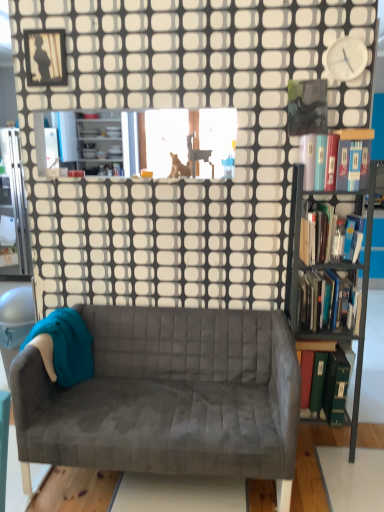
This screenshot has height=512, width=384. What do you see at coordinates (346, 58) in the screenshot?
I see `white plastic clock at upper right` at bounding box center [346, 58].

The width and height of the screenshot is (384, 512). I want to click on hardcover book at right, arranged as the 2th book when viewed from the top, so click(x=328, y=234).

The width and height of the screenshot is (384, 512). What are the coordinates of `green hardcover book at right, which appears as the 4th book when viewed from the top` in the screenshot? It's located at (314, 347).

Image resolution: width=384 pixels, height=512 pixels. What do you see at coordinates (336, 159) in the screenshot? I see `hardcover book at right, which is counted as the 1th book, starting from the top` at bounding box center [336, 159].

Describe the element at coordinates (45, 57) in the screenshot. The image size is (384, 512). I see `matte black picture frame at upper left` at that location.

The width and height of the screenshot is (384, 512). Describe the element at coordinates (330, 277) in the screenshot. I see `metallic black bookcase at right` at that location.

This screenshot has width=384, height=512. Identify the location of white plastic clock at upper right. (346, 58).

Would you consider green hardcover book at right, which appears as the 4th book when viewed from the top, to be distant from matte black picture frame at upper left?

green hardcover book at right, which appears as the 4th book when viewed from the top, is far away from matte black picture frame at upper left.

From the image's perspective, is green hardcover book at right, which appears as the 4th book when viewed from the top, above or below matte black picture frame at upper left?

green hardcover book at right, which appears as the 4th book when viewed from the top, is situated lower than matte black picture frame at upper left in the image.

Is green hardcover book at right, which appears as the 1th book when ordered from the bottom, bigger than matte black picture frame at upper left?

Yes.

Does point (316, 350) appear closer or farther from the camera than point (48, 62)?

Point (316, 350) is positioned closer to the camera compared to point (48, 62).

From the hardcover book at right, arranged as the third book when ordered from the bottom, count the 2nd book to the left and point to it. Please provide its 2D coordinates.

[(314, 347)]

From the image's perspective, is hardcover book at right, arranged as the 2th book when viewed from the top, located above green hardcover book at right, which appears as the 1th book when ordered from the bottom?

Yes, from the image's perspective, hardcover book at right, arranged as the 2th book when viewed from the top, is on top of green hardcover book at right, which appears as the 1th book when ordered from the bottom.

How many degrees apart are the facing directions of hardcover book at right, arranged as the third book when ordered from the bottom, and green hardcover book at right, which appears as the 1th book when ordered from the bottom?

The facing directions of hardcover book at right, arranged as the third book when ordered from the bottom, and green hardcover book at right, which appears as the 1th book when ordered from the bottom, are 1.54e-05 degrees apart.

Considering the positions of objects hardcover book at right, arranged as the 2th book when viewed from the top, and green hardcover book at right, which appears as the 4th book when viewed from the top, in the image provided, who is more to the left, hardcover book at right, arranged as the 2th book when viewed from the top, or green hardcover book at right, which appears as the 4th book when viewed from the top,?

Positioned to the left is green hardcover book at right, which appears as the 4th book when viewed from the top.

I want to click on clock behind the velvet gray couch at center, so click(346, 58).

From the image's perspective, does velvet gray couch at center appear lower than white plastic clock at upper right?

Yes, from the image's perspective, velvet gray couch at center is beneath white plastic clock at upper right.

Considering the positions of objects velvet gray couch at center and white plastic clock at upper right in the image provided, who is more to the right, velvet gray couch at center or white plastic clock at upper right?

white plastic clock at upper right.

Considering the sizes of objects velvet gray couch at center and white plastic clock at upper right in the image provided, who is shorter, velvet gray couch at center or white plastic clock at upper right?

white plastic clock at upper right is shorter.

Visually, is velvet gray couch at center positioned to the left or to the right of metallic black bookcase at right?

Based on their positions, velvet gray couch at center is located to the left of metallic black bookcase at right.

Based on the photo, from a real-world perspective, is velvet gray couch at center positioned above or below metallic black bookcase at right?

velvet gray couch at center is below metallic black bookcase at right.

Who is bigger, velvet gray couch at center or metallic black bookcase at right?

velvet gray couch at center is bigger.

Which of these two, velvet gray couch at center or metallic black bookcase at right, stands taller?

Standing taller between the two is metallic black bookcase at right.

Can hardcover book at right, arranged as the 2th book when viewed from the top, be found inside metallic black bookcase at right?

Yes, hardcover book at right, arranged as the 2th book when viewed from the top, is a part of metallic black bookcase at right.

Is metallic black bookcase at right taller or shorter than hardcover book at right, arranged as the third book when ordered from the bottom?

Considering their sizes, metallic black bookcase at right has more height than hardcover book at right, arranged as the third book when ordered from the bottom.

From the image's perspective, does metallic black bookcase at right appear lower than hardcover book at right, arranged as the 2th book when viewed from the top?

Yes.

Is green hardcover book at right, which appears as the 1th book when ordered from the bottom, positioned with its back to metallic black bookcase at right?

Yes.

Is green hardcover book at right, which appears as the 1th book when ordered from the bottom, far away from metallic black bookcase at right?

No, green hardcover book at right, which appears as the 1th book when ordered from the bottom, is not far from metallic black bookcase at right.

Which object is closer to the camera taking this photo, green hardcover book at right, which appears as the 4th book when viewed from the top, or metallic black bookcase at right?

metallic black bookcase at right.

In terms of height, does green hardcover book at right, which appears as the 4th book when viewed from the top, look taller or shorter compared to white plastic clock at upper right?

green hardcover book at right, which appears as the 4th book when viewed from the top, is taller than white plastic clock at upper right.

Which of these two, green hardcover book at right, which appears as the 4th book when viewed from the top, or white plastic clock at upper right, is bigger?

green hardcover book at right, which appears as the 4th book when viewed from the top, is bigger.

From the picture: Can you confirm if green hardcover book at right, which appears as the 4th book when viewed from the top, is wider than white plastic clock at upper right?

Indeed, green hardcover book at right, which appears as the 4th book when viewed from the top, has a greater width compared to white plastic clock at upper right.

Which book is the 1st one when counting from the front of the matte black picture frame at upper left? Please provide its 2D coordinates.

[(314, 347)]

This screenshot has height=512, width=384. I want to click on book that is the 2nd object located behind the hardcover book at right, arranged as the 2th book when viewed from the top, so click(x=314, y=347).

Looking at the image, which one is located closer to hardcover book at right, arranged as the 2th book when viewed from the top, white plastic clock at upper right or hardcover book at right, the 4th book from the bottom?

hardcover book at right, the 4th book from the bottom, lies closer to hardcover book at right, arranged as the 2th book when viewed from the top, than the other object.

Looking at the image, which one is located closer to metallic black bookcase at right, white plastic clock at upper right or brown furry dog at upper center?

white plastic clock at upper right lies closer to metallic black bookcase at right than the other object.

From the image, which object appears to be farther from velvet gray couch at center, green hardcover book at right, which appears as the 4th book when viewed from the top, or metallic black bookcase at right?

green hardcover book at right, which appears as the 4th book when viewed from the top.

From the picture: From the image, which object appears to be nearer to metallic black bookcase at right, green hardcover book at right, which appears as the 4th book when viewed from the top, or hardcover book at right, the 2th book when ordered from bottom to top?

Among the two, hardcover book at right, the 2th book when ordered from bottom to top, is located nearer to metallic black bookcase at right.

Which object lies nearer to the anchor point hardcover book at right, the 4th book from the bottom, white plastic clock at upper right or green hardcover book at right, which appears as the 4th book when viewed from the top?

Based on the image, white plastic clock at upper right appears to be nearer to hardcover book at right, the 4th book from the bottom.

Based on their spatial positions, is hardcover book at right, which is counted as the 1th book, starting from the top, or hardcover book at right, the third book positioned from the top, closer to green hardcover book at right, which appears as the 1th book when ordered from the bottom?

hardcover book at right, the third book positioned from the top.

Based on their spatial positions, is velvet gray couch at center or white plastic clock at upper right further from hardcover book at right, the 4th book from the bottom?

velvet gray couch at center lies further to hardcover book at right, the 4th book from the bottom, than the other object.

Estimate the real-world distances between objects in this image. Which object is further from hardcover book at right, arranged as the 2th book when viewed from the top, hardcover book at right, the 2th book when ordered from bottom to top, or metallic black bookcase at right?

Based on the image, hardcover book at right, the 2th book when ordered from bottom to top, appears to be further to hardcover book at right, arranged as the 2th book when viewed from the top.

Find the location of a particular element. bookcase between hardcover book at right, which is counted as the 1th book, starting from the top, and velvet gray couch at center, in the vertical direction is located at coordinates (330, 277).

Where is `book between hardcover book at right, which is counted as the 1th book, starting from the top, and hardcover book at right, the third book positioned from the top, in the up-down direction`? The width and height of the screenshot is (384, 512). book between hardcover book at right, which is counted as the 1th book, starting from the top, and hardcover book at right, the third book positioned from the top, in the up-down direction is located at coordinates (x=328, y=234).

The width and height of the screenshot is (384, 512). I want to click on bookcase situated between matte black picture frame at upper left and white plastic clock at upper right from left to right, so click(x=330, y=277).

This screenshot has width=384, height=512. What are the coordinates of `animal situated between matte black picture frame at upper left and metallic black bookcase at right from left to right` in the screenshot? It's located at (179, 167).